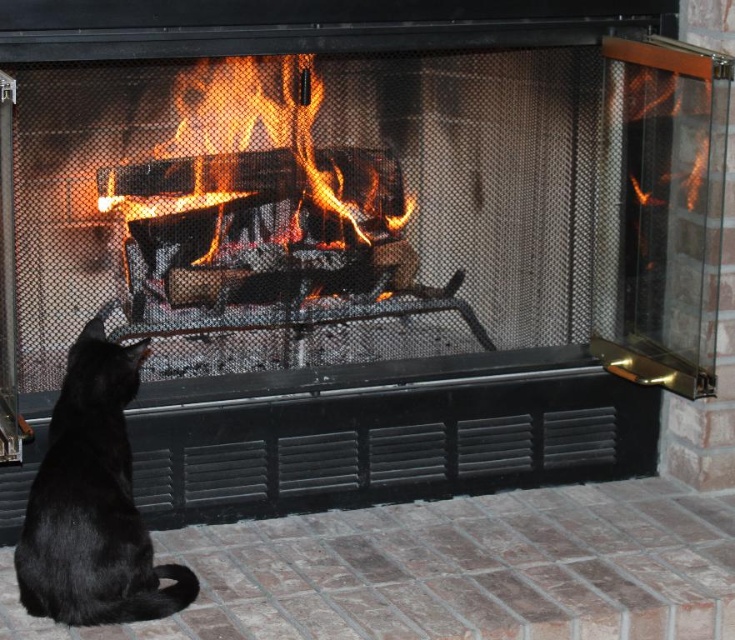
Who is more forward, (82, 516) or (401, 220)?

Point (82, 516) is more forward.

Can you confirm if black fur cat at lower left is wider than charcoal wood fire at center?

In fact, black fur cat at lower left might be narrower than charcoal wood fire at center.

The height and width of the screenshot is (640, 735). Identify the location of black fur cat at lower left. (93, 500).